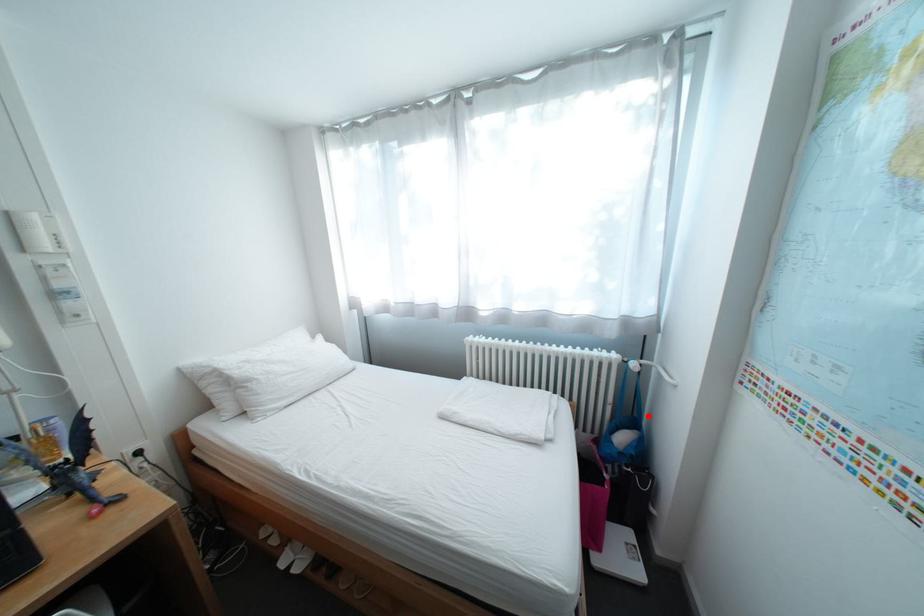
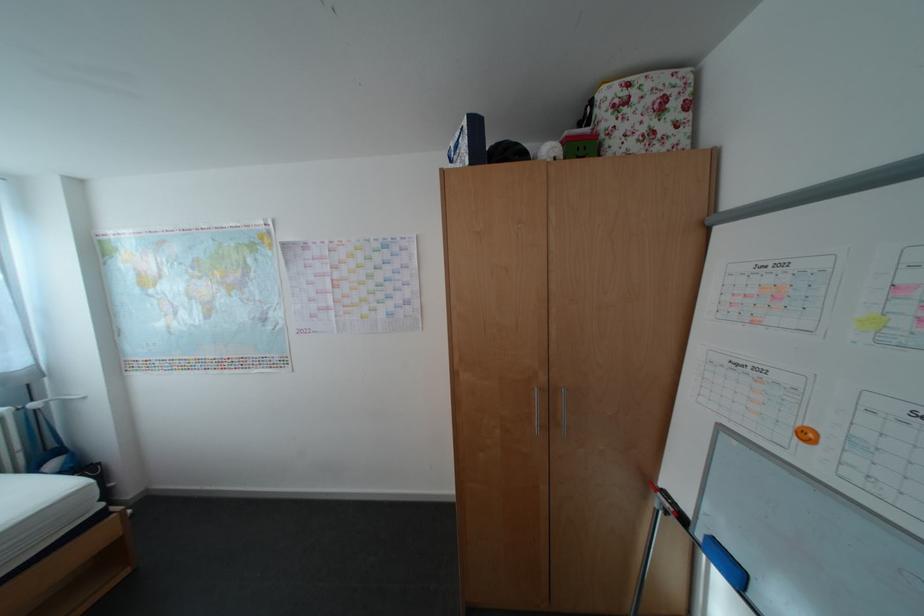
Question: I am providing you with two images of the same scene from different viewpoints. In image1, a red point is highlighted. Considering the same 3D point in image2, which of the following is correct?

Choices:
 (A) It is closer
 (B) It is farther

Answer: (B)